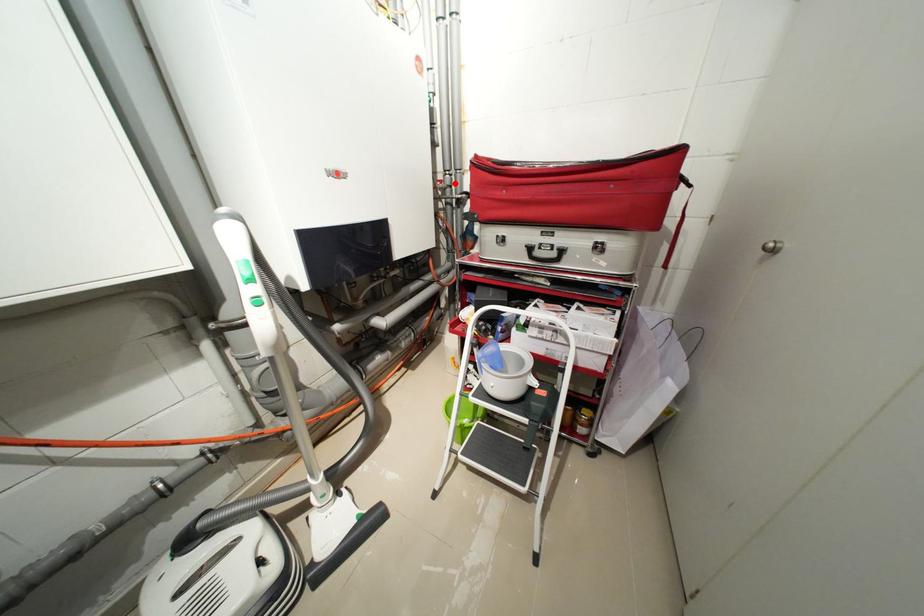
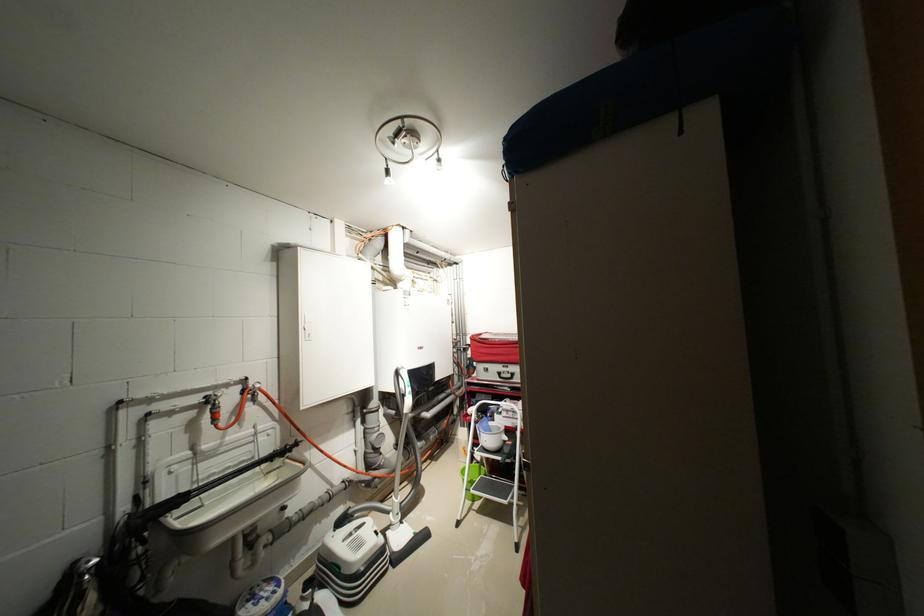
The point at the highlighted location is marked in the first image. Where is the corresponding point in the second image?

(466, 341)